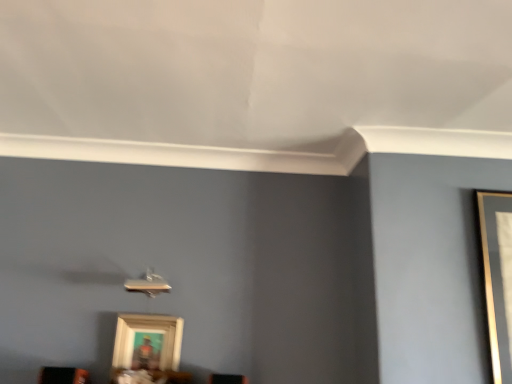
Question: From the image's perspective, is wooden framed picture at lower center on matte black speaker at lower left?

Choices:
 (A) yes
 (B) no

Answer: (A)

Question: From a real-world perspective, is wooden framed picture at lower center located higher than matte black speaker at lower left?

Choices:
 (A) no
 (B) yes

Answer: (B)

Question: From the image's perspective, is wooden framed picture at lower center under matte black speaker at lower left?

Choices:
 (A) no
 (B) yes

Answer: (A)

Question: Is wooden framed picture at lower center shorter than matte black speaker at lower left?

Choices:
 (A) no
 (B) yes

Answer: (A)

Question: Is wooden framed picture at lower center in contact with matte black speaker at lower left?

Choices:
 (A) no
 (B) yes

Answer: (A)

Question: Is wooden framed picture at lower center thinner than matte black speaker at lower left?

Choices:
 (A) no
 (B) yes

Answer: (B)

Question: Can you confirm if matte black speaker at lower left is taller than wooden framed picture at lower center?

Choices:
 (A) yes
 (B) no

Answer: (B)

Question: Is matte black speaker at lower left far from wooden framed picture at lower center?

Choices:
 (A) yes
 (B) no

Answer: (B)

Question: Is matte black speaker at lower left to the left of wooden framed picture at lower center from the viewer's perspective?

Choices:
 (A) yes
 (B) no

Answer: (A)

Question: Is matte black speaker at lower left next to wooden framed picture at lower center and touching it?

Choices:
 (A) no
 (B) yes

Answer: (A)

Question: Is matte black speaker at lower left bigger than wooden framed picture at lower center?

Choices:
 (A) yes
 (B) no

Answer: (B)

Question: Is the depth of matte black speaker at lower left greater than that of wooden framed picture at lower center?

Choices:
 (A) no
 (B) yes

Answer: (A)

Question: Does point (87, 380) appear closer or farther from the camera than point (123, 327)?

Choices:
 (A) closer
 (B) farther

Answer: (A)